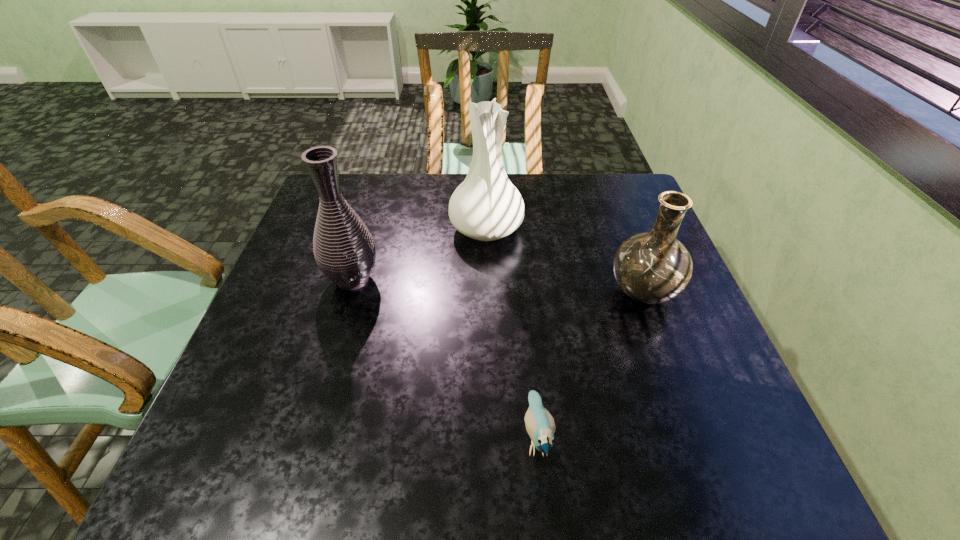
At what (x,y) coordinates should I click in order to perform the action: click on the farthest object. Please return your answer as a coordinate pair (x, y). The image size is (960, 540). Looking at the image, I should click on (486, 206).

Where is `the farthest vase`? the farthest vase is located at coordinates (486, 206).

Where is `the leftmost vase`? The height and width of the screenshot is (540, 960). the leftmost vase is located at coordinates (345, 252).

Where is `the shortest vase`? the shortest vase is located at coordinates (653, 267).

Locate an element on the screen. This screenshot has width=960, height=540. the rightmost object is located at coordinates (653, 267).

Find the location of a particular element. The width and height of the screenshot is (960, 540). the shortest object is located at coordinates (540, 425).

This screenshot has height=540, width=960. What are the coordinates of `the nearest object` in the screenshot? It's located at (540, 425).

Where is `free spot located 0.330m on the front of the farthest object`? The image size is (960, 540). free spot located 0.330m on the front of the farthest object is located at coordinates (488, 352).

The image size is (960, 540). In order to click on vacant area situated 0.140m on the back of the leftmost object in this screenshot , I will do `click(368, 228)`.

Where is `vacant space situated on the front of the third tallest object`? Image resolution: width=960 pixels, height=540 pixels. vacant space situated on the front of the third tallest object is located at coordinates (708, 472).